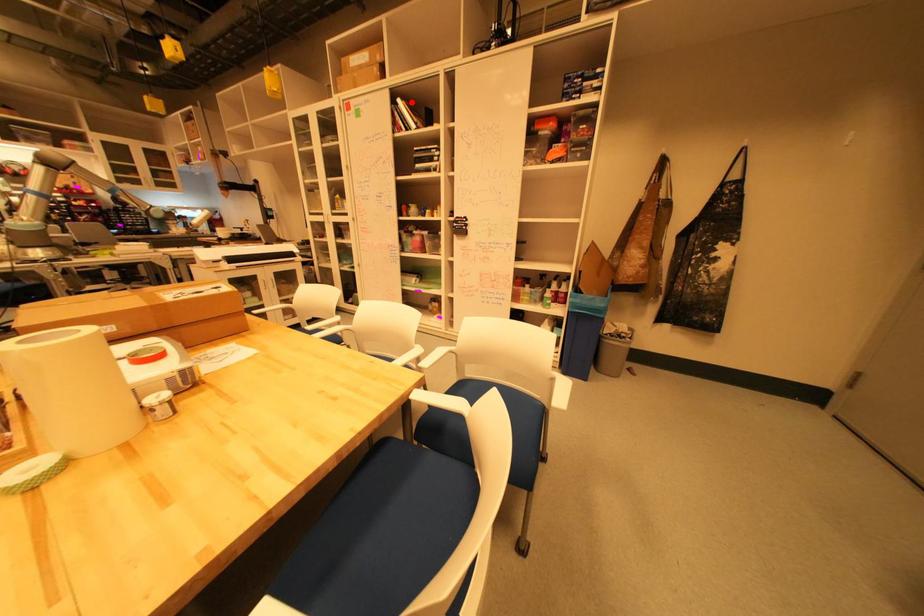
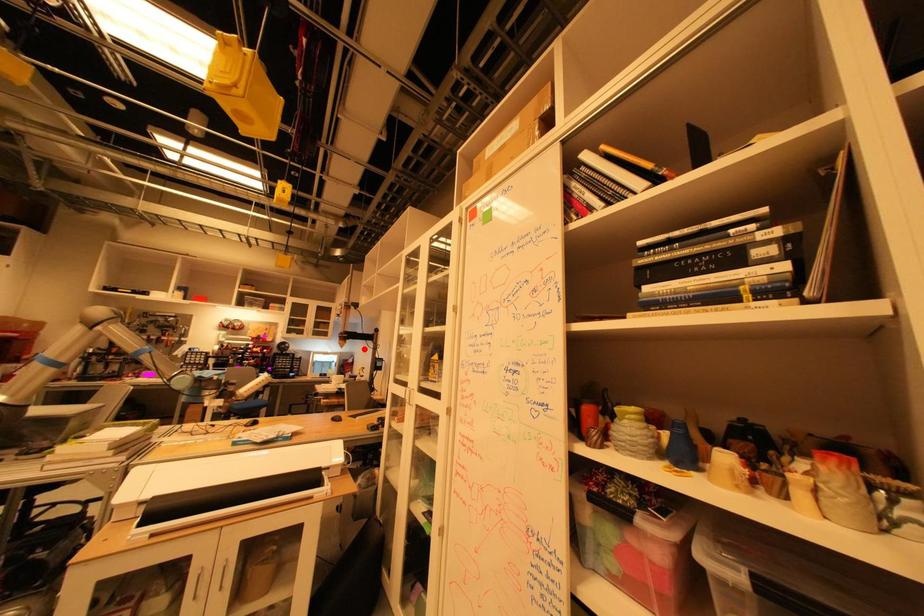
I am providing you with two images of the same scene from different viewpoints. A red point is marked on the first image and another point is marked on the second image. Do the highlighted points in image1 and image2 indicate the same real-world spot?

No